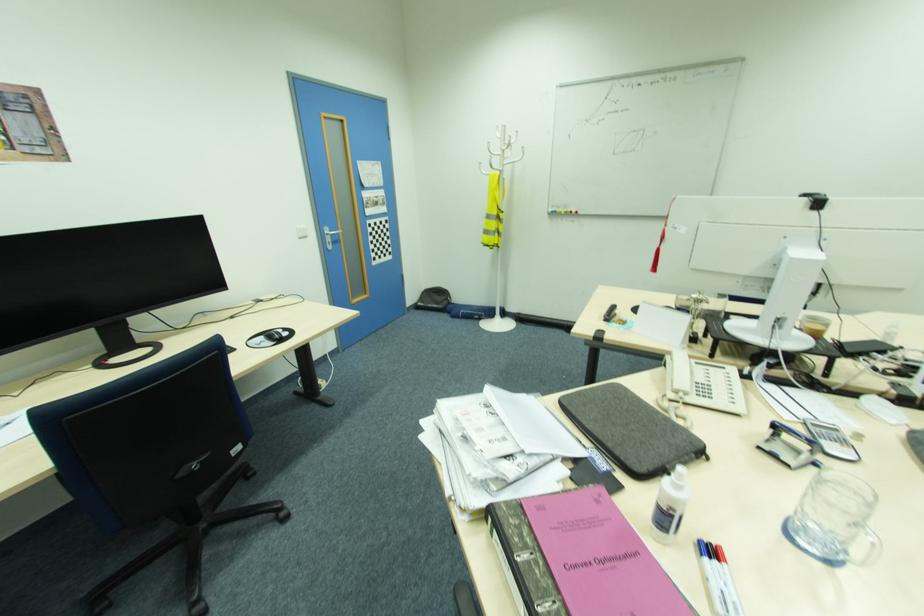
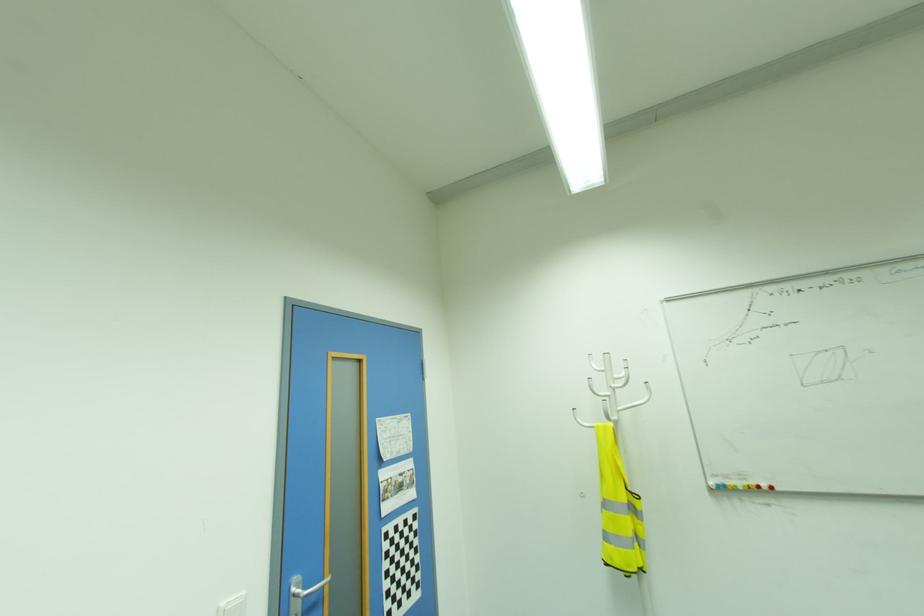
Locate, in the second image, the point that corresponds to the point at 506,161 in the first image.

(622, 408)